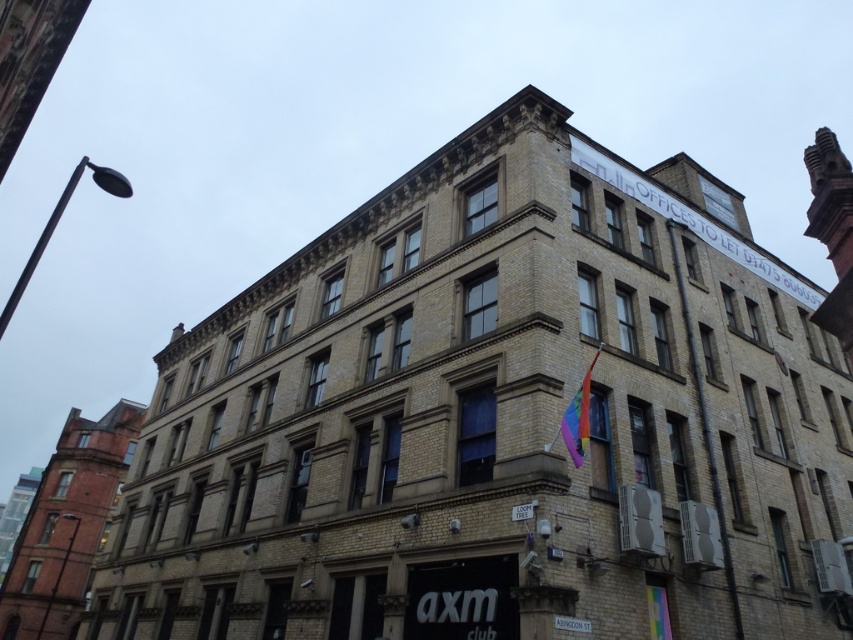
Question: Is rainbow fabric flag at upper right bigger than white plastic sign at lower center?

Choices:
 (A) yes
 (B) no

Answer: (A)

Question: Which point is closer to the camera?

Choices:
 (A) rainbow fabric flag at upper right
 (B) white plastic sign at lower center

Answer: (B)

Question: Which point is closer to the camera?

Choices:
 (A) rainbow fabric flag at upper right
 (B) white plastic sign at lower center

Answer: (B)

Question: Can you confirm if rainbow fabric flag at upper right is positioned below white plastic sign at lower center?

Choices:
 (A) no
 (B) yes

Answer: (A)

Question: Is the position of rainbow fabric flag at upper right more distant than that of white plastic sign at lower center?

Choices:
 (A) yes
 (B) no

Answer: (A)